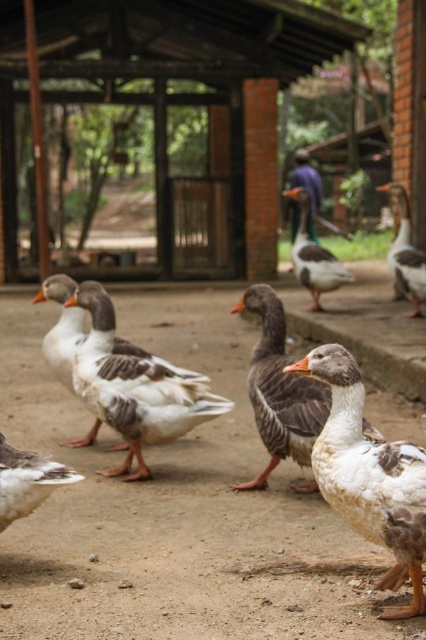
Question: Is white-feathered goose at center wider than white-gray feathered duck at right?

Choices:
 (A) yes
 (B) no

Answer: (A)

Question: Which of the following is the closest to the observer?

Choices:
 (A) gray matte duck at center
 (B) white matte duck at lower left
 (C) gray matte goose at center

Answer: (B)

Question: Does white-gray feathered duck at center lie behind white-gray feathered duck at right?

Choices:
 (A) no
 (B) yes

Answer: (A)

Question: Estimate the real-world distances between objects in this image. Which object is closer to the gray matte duck at center?

Choices:
 (A) white-gray feathered duck at center
 (B) gray matte goose at center

Answer: (B)

Question: Which point is farther to the camera?

Choices:
 (A) gray matte duck at center
 (B) white-feathered goose at center
 (C) gray matte goose at center

Answer: (A)

Question: Can you confirm if white-feathered goose at center is smaller than gray matte duck at center?

Choices:
 (A) yes
 (B) no

Answer: (A)